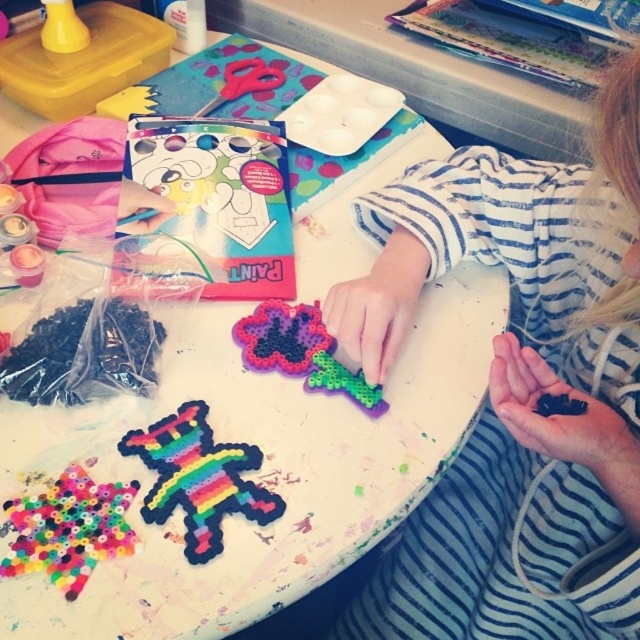
You are a child trying to pick up the beads from the table. You notice two points on the table where beads are scattered. Which point is closer to you, point (195, 406) or point (282, 353)?

Point (195, 406) is closer to the viewer than point (282, 353), so you should pick up the beads from point (195, 406) first.

You are a craft instructor observing a student working on a project. You notice the rainbow plastic beads at center and the translucent plastic flower at center. Which object is positioned lower on the table surface?

The rainbow plastic beads at center is positioned lower on the table surface because it is below the translucent plastic flower at center.

You are a child trying to stack the rainbow plastic toy at lower left and the translucent plastic flower at center. Which one should you place at the bottom to make the stack stable?

The rainbow plastic toy at lower left should be placed at the bottom since it is shorter than the translucent plastic flower at center, allowing the taller flower to sit more stably on top.